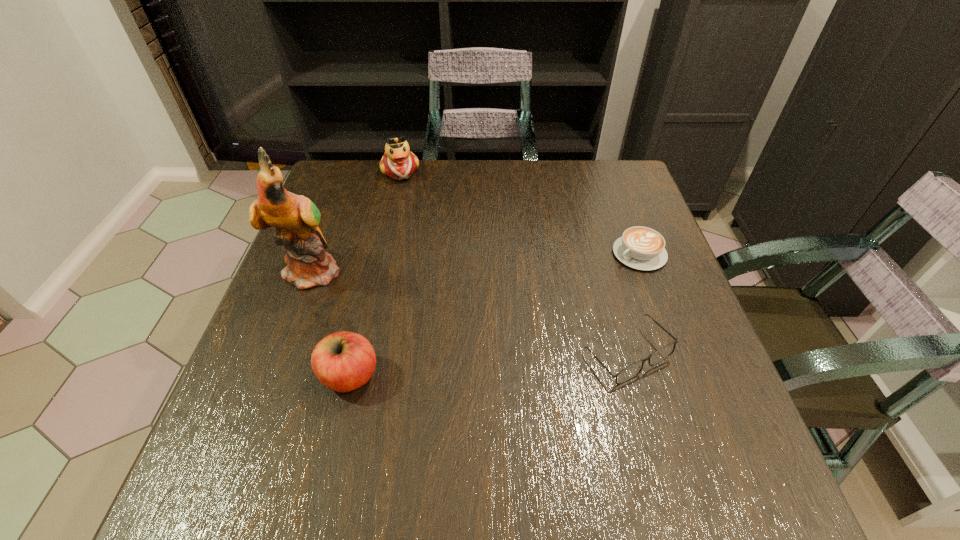
Where is `the third tallest object`? the third tallest object is located at coordinates (343, 361).

The height and width of the screenshot is (540, 960). Find the location of `spectacles`. spectacles is located at coordinates (633, 370).

I want to click on the farthest object, so click(398, 162).

Image resolution: width=960 pixels, height=540 pixels. Find the location of `cappuccino`. cappuccino is located at coordinates (642, 248).

Locate an element on the screen. The height and width of the screenshot is (540, 960). parrot is located at coordinates (296, 218).

Identify the location of the leftmost object. (296, 218).

Locate an element on the screen. free point located 0.380m on the right of the third tallest object is located at coordinates (581, 376).

Find the location of a particular element. This screenshot has width=960, height=540. blank space located on the face of the duck is located at coordinates point(443,277).

In order to click on vacant region located on the face of the duck in this screenshot , I will do `click(420, 220)`.

Find the location of a particular element. This screenshot has height=540, width=960. free space located 0.120m on the face of the duck is located at coordinates (414, 207).